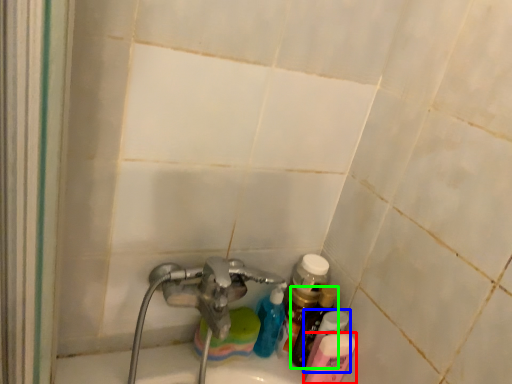
Question: Which object is the closest to the toiletry (highlighted by a red box)? Choose among these: toiletry (highlighted by a blue box) or bottle (highlighted by a green box).

Choices:
 (A) toiletry
 (B) bottle

Answer: (A)